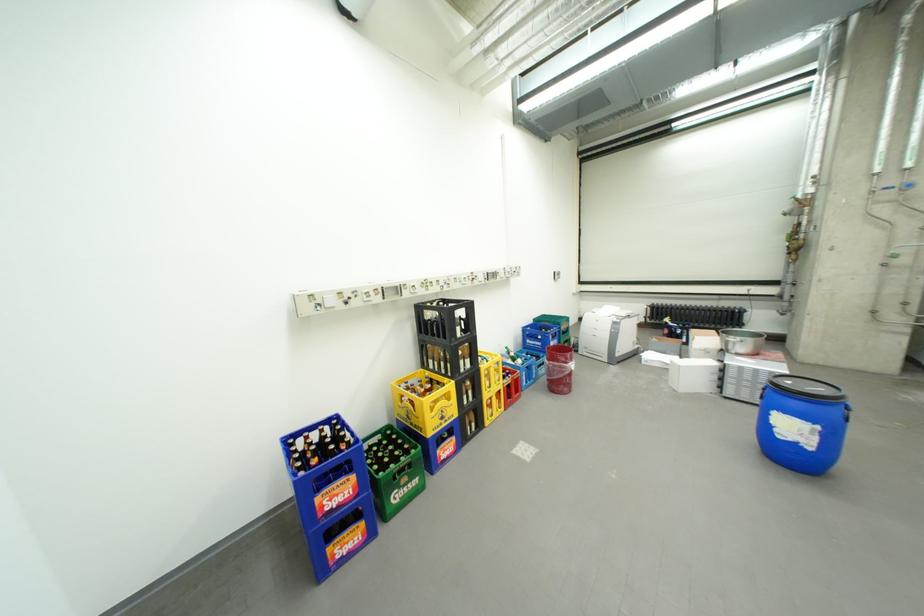
Locate an element on the screen. This screenshot has height=616, width=924. brown glass bottle is located at coordinates [x=444, y=318].